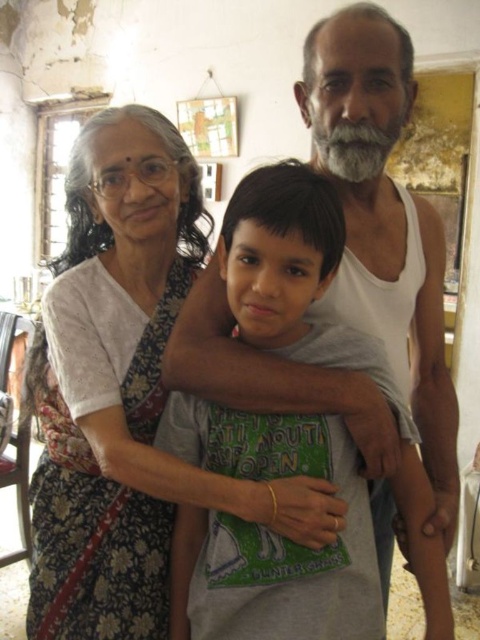
Who is lower down, white cotton tank top at center or white printed saree at left?

Positioned lower is white printed saree at left.

Is white cotton tank top at center thinner than white printed saree at left?

In fact, white cotton tank top at center might be wider than white printed saree at left.

Which is in front, point (433, 356) or point (50, 636)?

Point (50, 636) is in front.

Where is `white cotton tank top at center`? white cotton tank top at center is located at coordinates (384, 224).